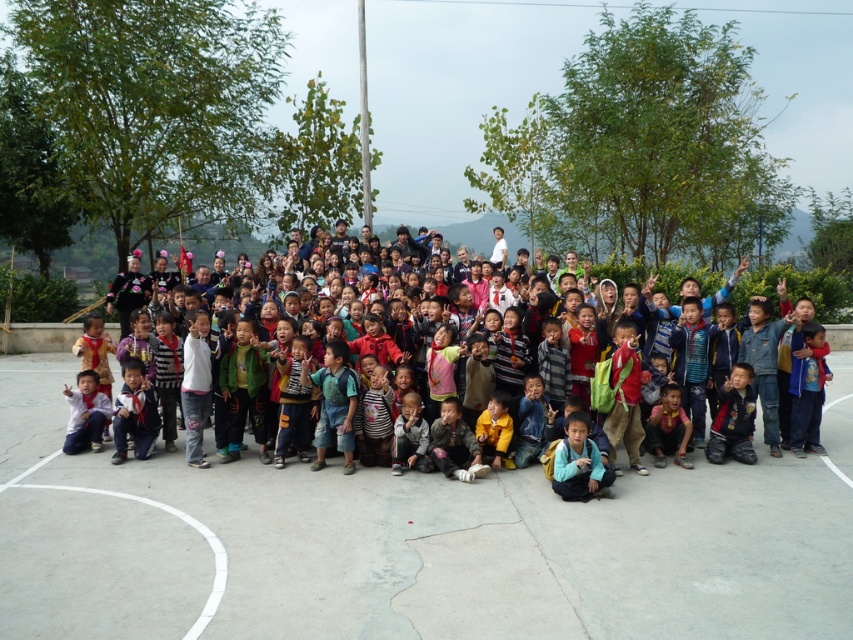
Question: Is gray concrete basketball court at center positioned at the back of multicolored clothing at center?

Choices:
 (A) no
 (B) yes

Answer: (A)

Question: Which of the following is the closest to the observer?

Choices:
 (A) (138, 592)
 (B) (548, 474)

Answer: (A)

Question: Which object appears closest to the camera in this image?

Choices:
 (A) gray concrete basketball court at center
 (B) multicolored clothing at center

Answer: (A)

Question: Observing the image, what is the correct spatial positioning of gray concrete basketball court at center in reference to multicolored clothing at center?

Choices:
 (A) left
 (B) right

Answer: (A)

Question: Which of the following is the closest to the observer?

Choices:
 (A) (480, 348)
 (B) (639, 493)

Answer: (B)

Question: From the image, what is the correct spatial relationship of gray concrete basketball court at center in relation to multicolored clothing at center?

Choices:
 (A) right
 (B) left

Answer: (B)